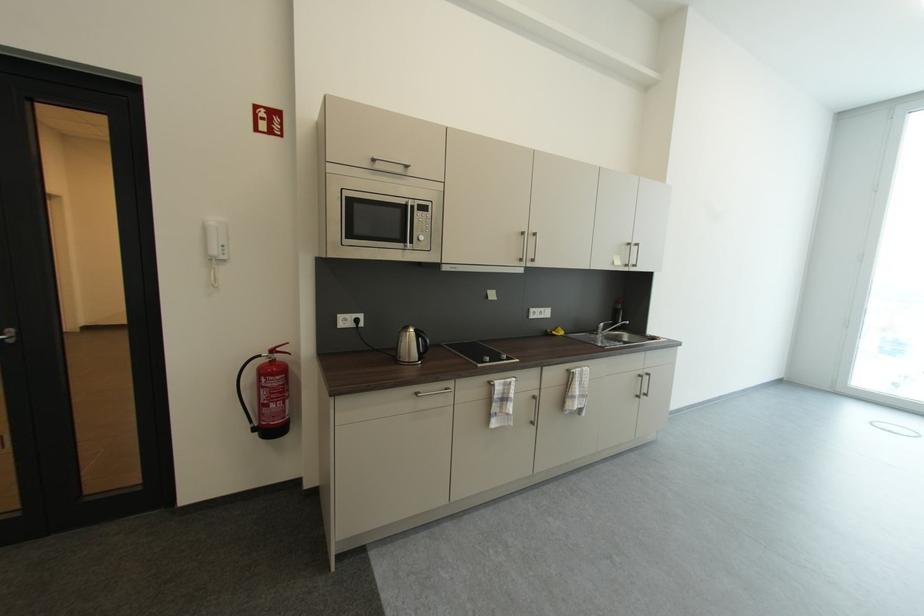
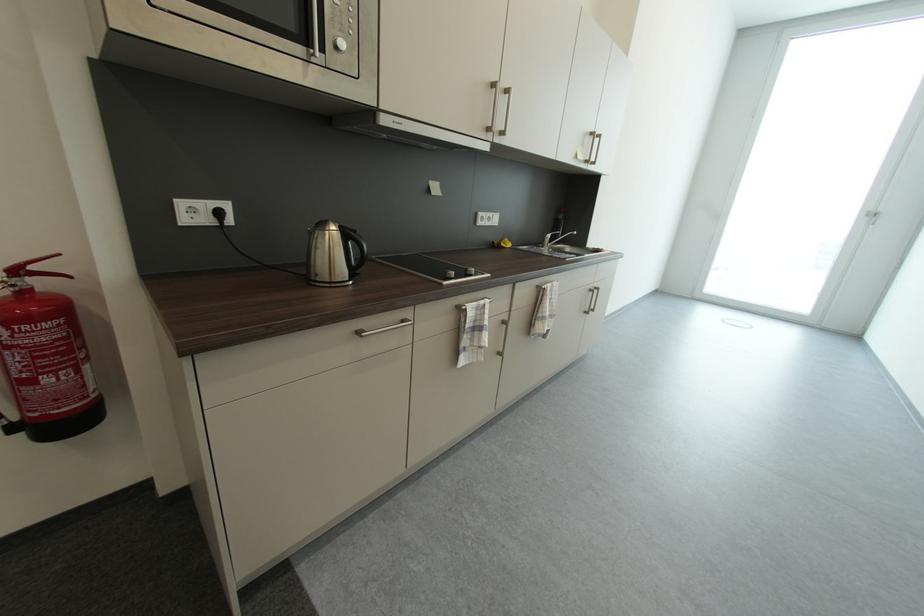
Question: How did the camera likely rotate?

Choices:
 (A) Left
 (B) Right
 (C) Up
 (D) Down

Answer: (B)